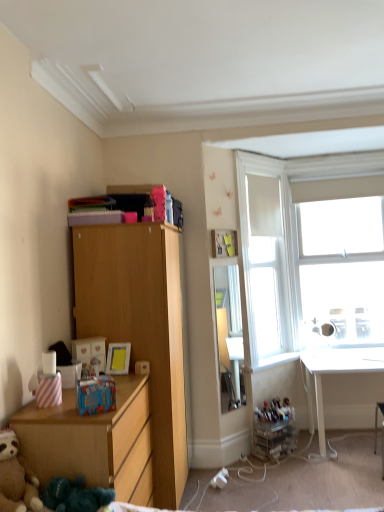
Question: Considering the positions of white glossy window sill at lower right and light wood cabinet at left in the image, is white glossy window sill at lower right taller or shorter than light wood cabinet at left?

Choices:
 (A) tall
 (B) short

Answer: (B)

Question: Does point (251, 370) appear closer or farther from the camera than point (180, 318)?

Choices:
 (A) closer
 (B) farther

Answer: (B)

Question: Which object is positioned farthest from the brown plush teddy bear at lower left?

Choices:
 (A) white fabric at upper right
 (B) wooden chest of drawers at lower left
 (C) white glossy window sill at lower right
 (D) white glossy desk at lower right
 (E) matte yellow picture frame at upper center

Answer: (D)

Question: Considering the real-world distances, which object is closest to the white plastic power outlet at lower center?

Choices:
 (A) matte yellow picture frame at upper center
 (B) light wood cabinet at left
 (C) white glossy window sill at lower right
 (D) white glass window at upper right
 (E) white glossy desk at lower right

Answer: (C)